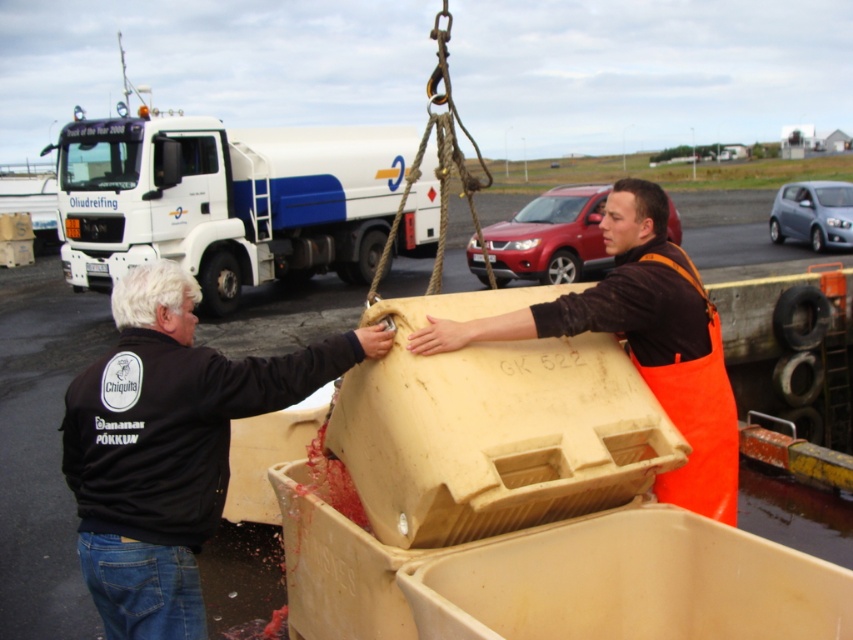
Does white glossy truck at upper left appear over black fabric jacket at left?

Indeed, white glossy truck at upper left is positioned over black fabric jacket at left.

Who is more distant from viewer, [70,125] or [177,476]?

Positioned behind is point [70,125].

Describe the element at coordinates (225, 200) in the screenshot. I see `white glossy truck at upper left` at that location.

Where is `white glossy truck at upper left`? white glossy truck at upper left is located at coordinates (225, 200).

Does white glossy truck at upper left appear on the left side of orange apron at center?

Yes, white glossy truck at upper left is to the left of orange apron at center.

In the scene shown: Can you confirm if white glossy truck at upper left is smaller than orange apron at center?

Yes, white glossy truck at upper left is smaller than orange apron at center.

In order to click on white glossy truck at upper left in this screenshot , I will do `click(225, 200)`.

Does black fabric jacket at left have a smaller size compared to orange apron at center?

Indeed, black fabric jacket at left has a smaller size compared to orange apron at center.

How far apart are black fabric jacket at left and orange apron at center?

black fabric jacket at left and orange apron at center are 3.28 feet apart from each other.

The width and height of the screenshot is (853, 640). What are the coordinates of `black fabric jacket at left` in the screenshot? It's located at (169, 445).